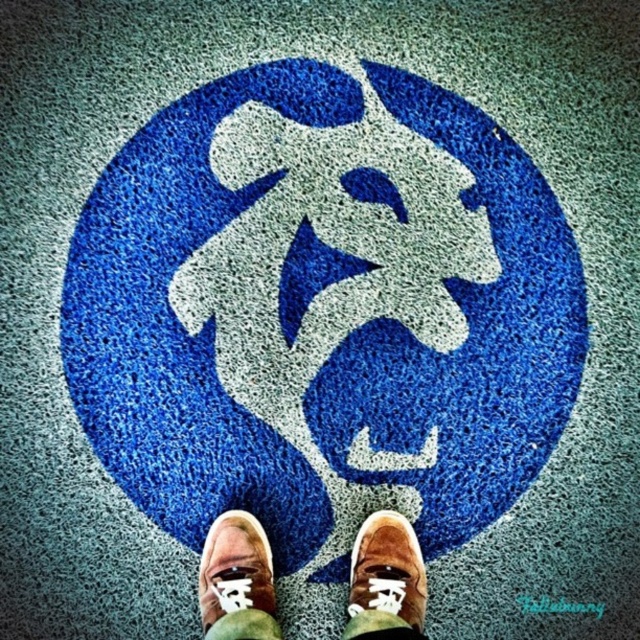
Does blue textured carpet at center appear over brown suede shoe at lower center?

Yes.

Can you confirm if blue textured carpet at center is bigger than brown suede shoe at lower center?

Indeed, blue textured carpet at center has a larger size compared to brown suede shoe at lower center.

Is point (134, 170) less distant than point (412, 593)?

That is False.

You are a GUI agent. You are given a task and a screenshot of the screen. Output one action in this format:
    pyautogui.click(x=<x>, y=<y>)
    Task: Click on the blue textured carpet at center
    This screenshot has width=640, height=640.
    Given the screenshot: What is the action you would take?
    pyautogui.click(x=323, y=310)

Locate an element on the screen. The height and width of the screenshot is (640, 640). blue textured carpet at center is located at coordinates (323, 310).

Does blue textured carpet at center have a larger size compared to brown suede shoes at center?

Indeed, blue textured carpet at center has a larger size compared to brown suede shoes at center.

Where is `blue textured carpet at center`? blue textured carpet at center is located at coordinates (323, 310).

Who is higher up, brown suede shoes at center or suede brown shoe at center?

suede brown shoe at center is higher up.

Who is positioned more to the left, brown suede shoes at center or suede brown shoe at center?

Positioned to the left is suede brown shoe at center.

Describe the element at coordinates (237, 580) in the screenshot. This screenshot has height=640, width=640. I see `brown suede shoes at center` at that location.

At what (x,y) coordinates should I click in order to perform the action: click on brown suede shoes at center. Please return your answer as a coordinate pair (x, y). Looking at the image, I should click on (237, 580).